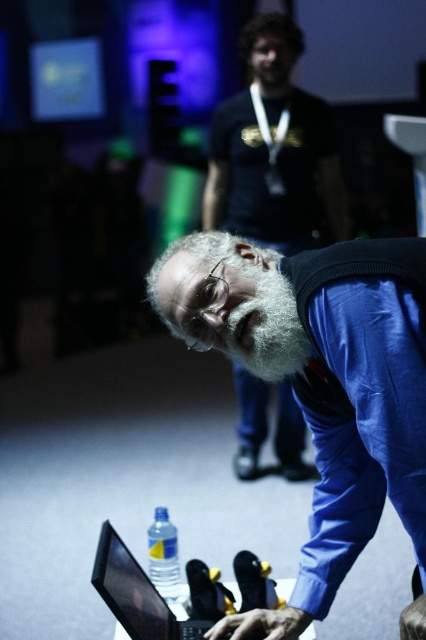
Does blue fabric sweater at center have a greater height compared to black glossy laptop at lower left?

Indeed, blue fabric sweater at center has a greater height compared to black glossy laptop at lower left.

Does point (365, 506) lie behind point (134, 577)?

No, (365, 506) is closer to viewer.

Locate an element on the screen. blue fabric sweater at center is located at coordinates (321, 385).

Is the position of graywoollybeard at center more distant than that of clear plastic bottle at lower center?

No, it is not.

The width and height of the screenshot is (426, 640). I want to click on graywoollybeard at center, so click(264, 323).

Is gray beard at center below clear plastic bottle at lower center?

Actually, gray beard at center is above clear plastic bottle at lower center.

Does point (258, 378) come behind point (178, 557)?

Yes.

This screenshot has width=426, height=640. What are the coordinates of `gray beard at center` in the screenshot? It's located at (273, 150).